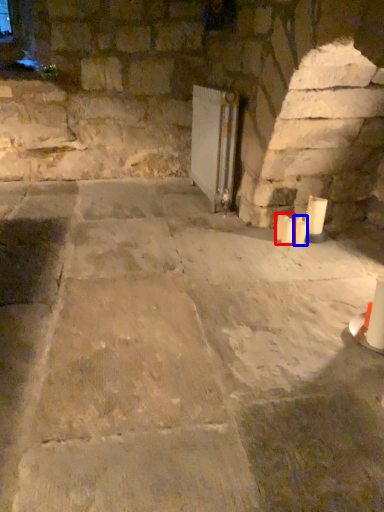
Question: Which object is further to the camera taking this photo, candle (highlighted by a red box) or candle (highlighted by a blue box)?

Choices:
 (A) candle
 (B) candle

Answer: (B)